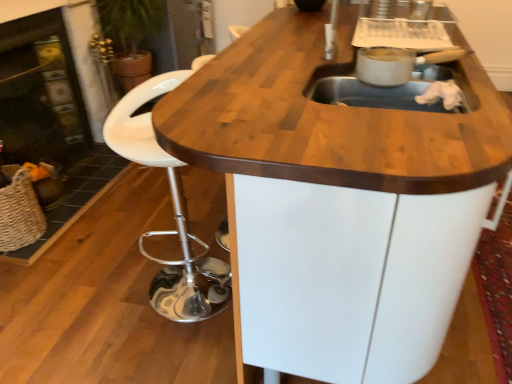
In order to click on vacant space underneath white plastic stool at lower left (from a real-world perspective) in this screenshot , I will do `click(173, 276)`.